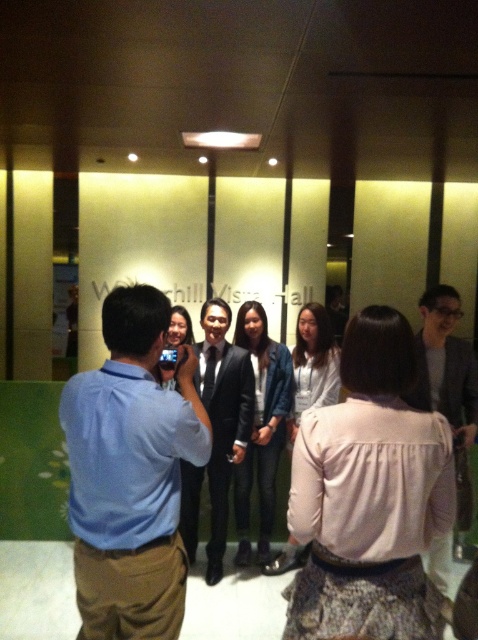
Question: Which object is the closest to the black suit at center?

Choices:
 (A) blue shirt at left
 (B) matte black suit at center

Answer: (B)

Question: Which object appears closest to the camera in this image?

Choices:
 (A) black suit at center
 (B) matte black suit at center

Answer: (B)

Question: Is black suit at center in front of matte black suit at center?

Choices:
 (A) no
 (B) yes

Answer: (A)

Question: Which of these objects is positioned farthest from the black suit at center?

Choices:
 (A) matte black suit at center
 (B) blue shirt at left

Answer: (B)

Question: Observing the image, what is the correct spatial positioning of blue shirt at left in reference to black suit at center?

Choices:
 (A) above
 (B) below

Answer: (A)

Question: Is blue shirt at left to the right of black suit at center from the viewer's perspective?

Choices:
 (A) no
 (B) yes

Answer: (A)